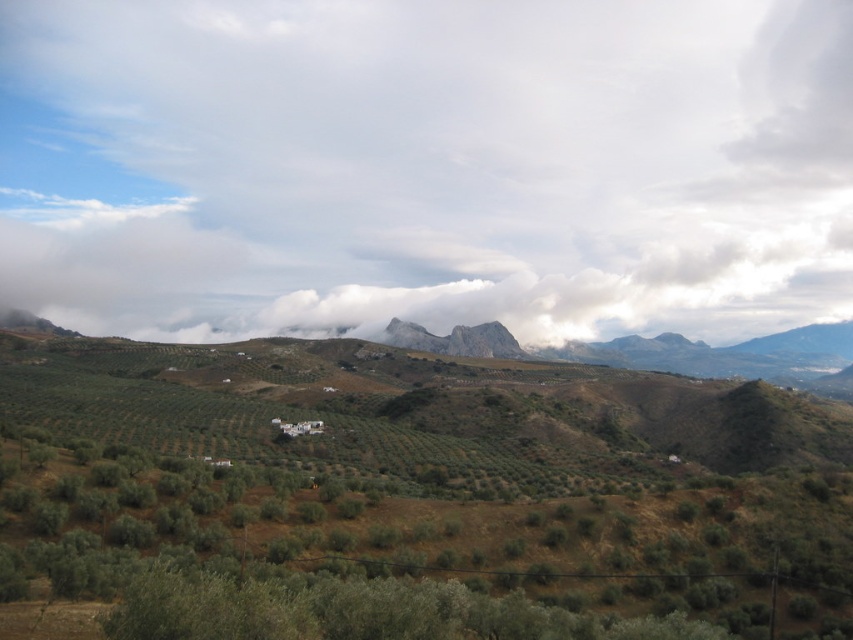
Question: Does white fluffy cloud at upper center appear under green leafy shrubs at center?

Choices:
 (A) yes
 (B) no

Answer: (B)

Question: Is white fluffy cloud at upper center further to camera compared to green leafy shrubs at center?

Choices:
 (A) no
 (B) yes

Answer: (B)

Question: Which point is closer to the camera taking this photo?

Choices:
 (A) (469, 374)
 (B) (6, 3)

Answer: (A)

Question: Is white fluffy cloud at upper center to the right of green leafy shrubs at center from the viewer's perspective?

Choices:
 (A) no
 (B) yes

Answer: (B)